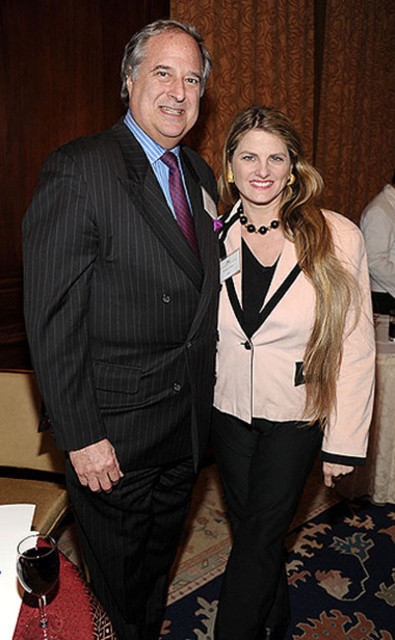
Is point (372, 257) positioned before point (33, 577)?

No.

The height and width of the screenshot is (640, 395). What do you see at coordinates (381, 246) in the screenshot?
I see `black pinstripe suit at center` at bounding box center [381, 246].

Find the location of a particular element. Image resolution: width=395 pixels, height=640 pixels. black pinstripe suit at center is located at coordinates (381, 246).

In the scene shown: Can you confirm if pinstriped suit at center is wider than pink fabric jacket at center?

Correct, the width of pinstriped suit at center exceeds that of pink fabric jacket at center.

In order to click on pinstriped suit at center in this screenshot , I will do `click(129, 321)`.

Where is `pinstriped suit at center`? This screenshot has width=395, height=640. pinstriped suit at center is located at coordinates (129, 321).

Can you confirm if pinstriped suit at center is positioned below black pinstripe suit at center?

Yes.

Does pinstriped suit at center come in front of black pinstripe suit at center?

That is True.

Is point (109, 582) closer to camera compared to point (368, 205)?

Yes, it is.

The height and width of the screenshot is (640, 395). What are the coordinates of `pinstriped suit at center` in the screenshot? It's located at (129, 321).